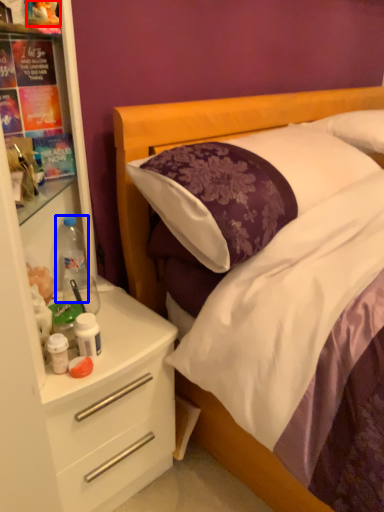
Question: Which object is closer to the camera taking this photo, toy (highlighted by a red box) or bottle (highlighted by a blue box)?

Choices:
 (A) toy
 (B) bottle

Answer: (A)